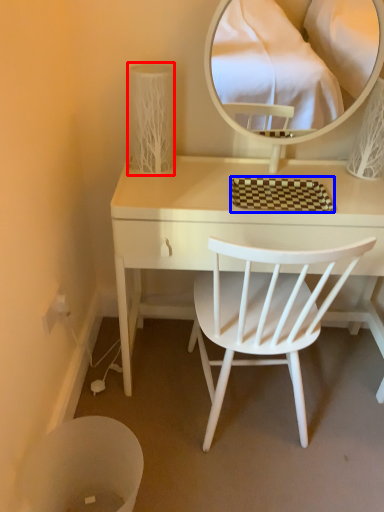
Question: Which of the following is the closest to the observer, table lamp (highlighted by a red box) or mat (highlighted by a blue box)?

Choices:
 (A) table lamp
 (B) mat

Answer: (B)